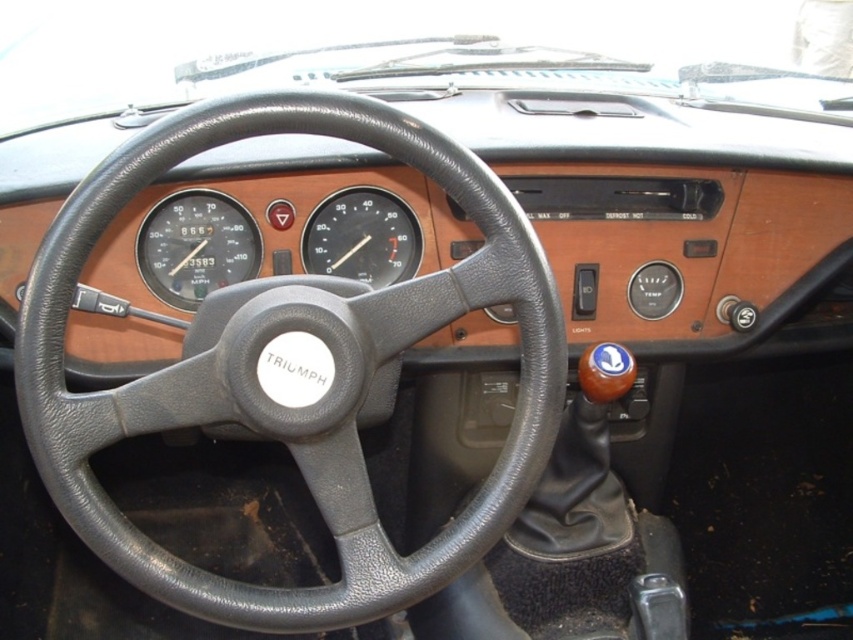
Question: Which object is closer to the camera taking this photo?

Choices:
 (A) black plastic speedometer at center
 (B) matte black speedometer at center

Answer: (B)

Question: Is matte black speedometer at center above black plastic speedometer at center?

Choices:
 (A) yes
 (B) no

Answer: (B)

Question: Can you confirm if matte black speedometer at center is positioned to the right of black plastic speedometer at center?

Choices:
 (A) no
 (B) yes

Answer: (A)

Question: Can you confirm if matte black speedometer at center is wider than black plastic speedometer at center?

Choices:
 (A) yes
 (B) no

Answer: (B)

Question: Which object appears closest to the camera in this image?

Choices:
 (A) black plastic speedometer at center
 (B) matte black speedometer at center

Answer: (B)

Question: Which object is farther from the camera taking this photo?

Choices:
 (A) matte black speedometer at center
 (B) black plastic speedometer at center

Answer: (B)